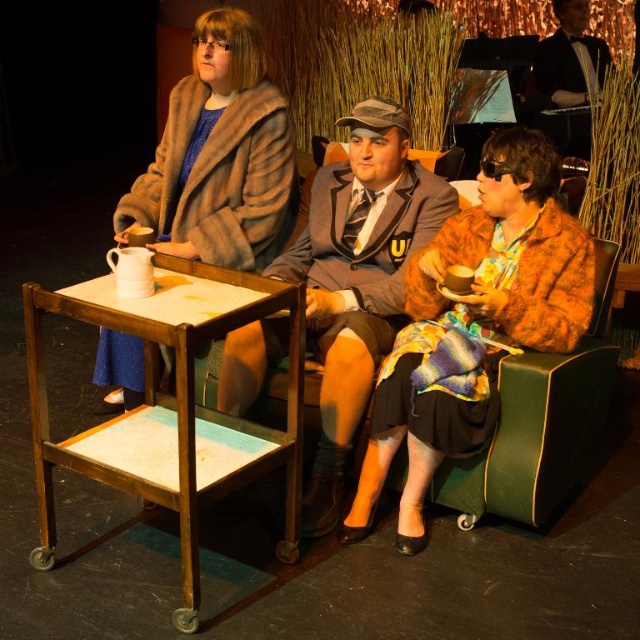
You are an actor standing on the stage and need to move from the brown wooden table at center to the velvet green armchair at right. Which direction should you move to reach the chair?

The brown wooden table at center is positioned on the left side of the velvet green armchair at right, so you should move to the right to reach the chair.

You are a stagehand preparing to move the brown wooden table at center and the velvet green armchair at right. Which object requires more space to maneuver due to its size?

The brown wooden table at center requires more space to maneuver because it has a larger size compared to the velvet green armchair at right.

You are standing at the position of the viewer. There is a fur coat at upper left that you want to grab. Can you reach it without moving your feet?

The fur coat at upper left is 2.56 meters away from the viewer, so you cannot reach it without moving your feet.